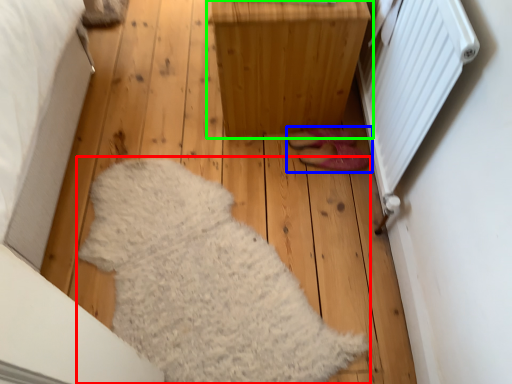
Question: Estimate the real-world distances between objects in this image. Which object is farther from blanket (highlighted by a red box), footwear (highlighted by a blue box) or furniture (highlighted by a green box)?

Choices:
 (A) footwear
 (B) furniture

Answer: (A)